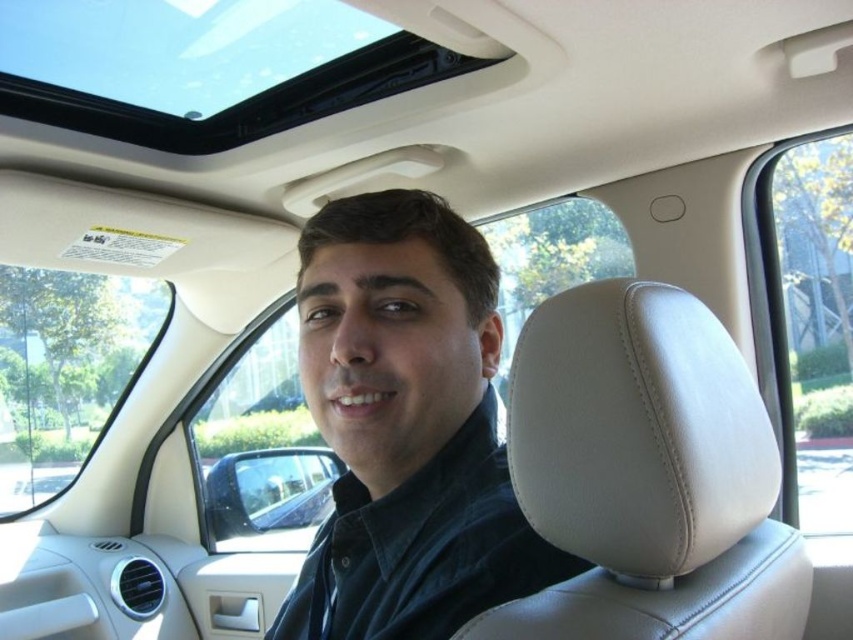
Question: Can you confirm if beige leather headrest at center is bigger than matte black shirt at center?

Choices:
 (A) yes
 (B) no

Answer: (B)

Question: Does beige leather headrest at center have a greater width compared to matte black shirt at center?

Choices:
 (A) no
 (B) yes

Answer: (B)

Question: Which point is closer to the camera taking this photo?

Choices:
 (A) (479, 234)
 (B) (605, 515)

Answer: (B)

Question: Is beige leather headrest at center behind matte black shirt at center?

Choices:
 (A) no
 (B) yes

Answer: (A)

Question: Which point is farther to the camera?

Choices:
 (A) (412, 273)
 (B) (730, 456)

Answer: (A)